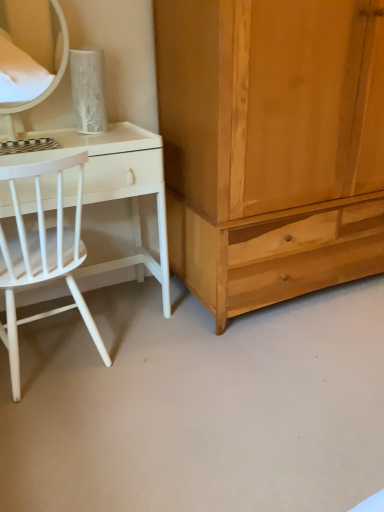
This screenshot has height=512, width=384. What are the coordinates of `vacant area that is situated to the right of matte white mirror at upper left` in the screenshot? It's located at (96, 138).